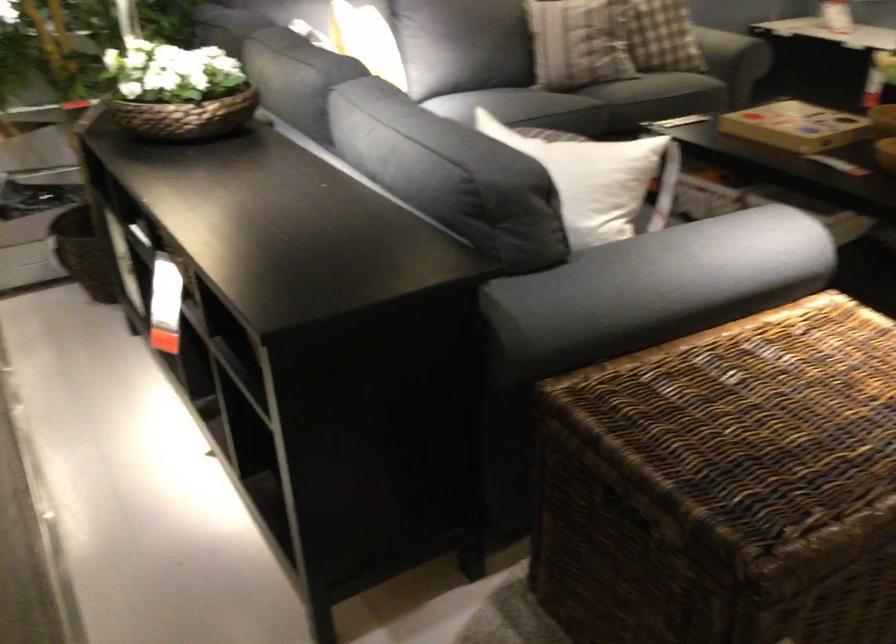
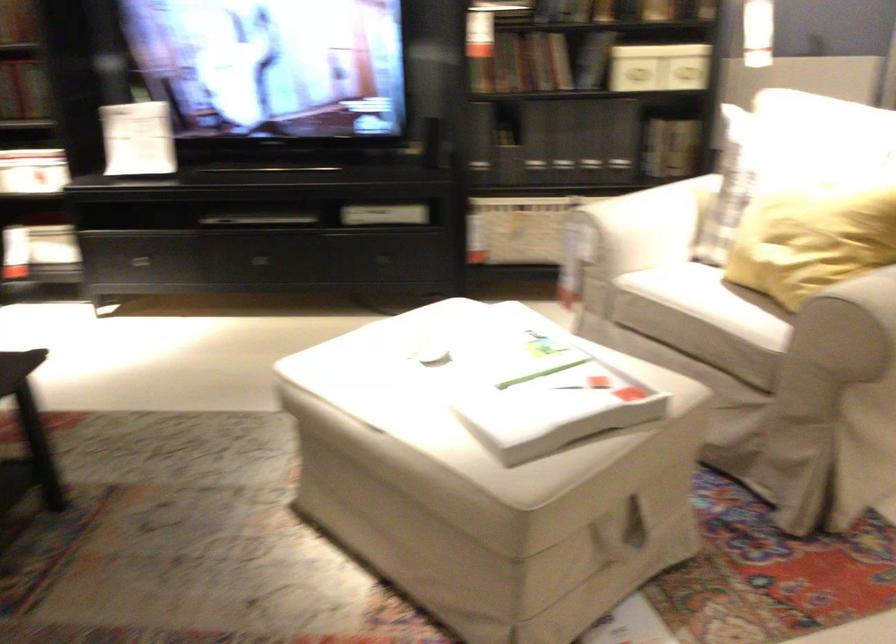
Question: The first image is from the beginning of the video and the second image is from the end. How did the camera likely rotate when shooting the video?

Choices:
 (A) Left
 (B) Right
 (C) Up
 (D) Down

Answer: (B)